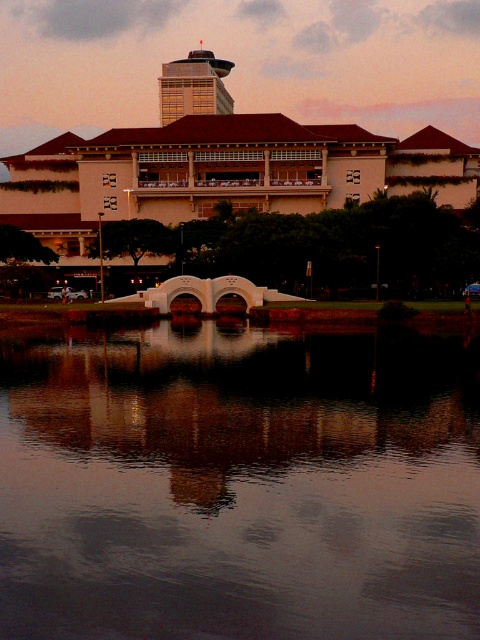
Question: Is smooth reflective water at center to the right of matte beige building at center from the viewer's perspective?

Choices:
 (A) no
 (B) yes

Answer: (B)

Question: Is smooth reflective water at center thinner than matte beige building at center?

Choices:
 (A) no
 (B) yes

Answer: (B)

Question: Which of the following is the farthest from the observer?

Choices:
 (A) matte beige building at center
 (B) smooth reflective water at center

Answer: (A)

Question: Can you confirm if smooth reflective water at center is positioned below matte beige building at center?

Choices:
 (A) yes
 (B) no

Answer: (A)

Question: Which of the following is the closest to the observer?

Choices:
 (A) (108, 134)
 (B) (196, 476)

Answer: (B)

Question: Which point appears farthest from the camera in this image?

Choices:
 (A) 256,544
 (B) 466,156

Answer: (B)